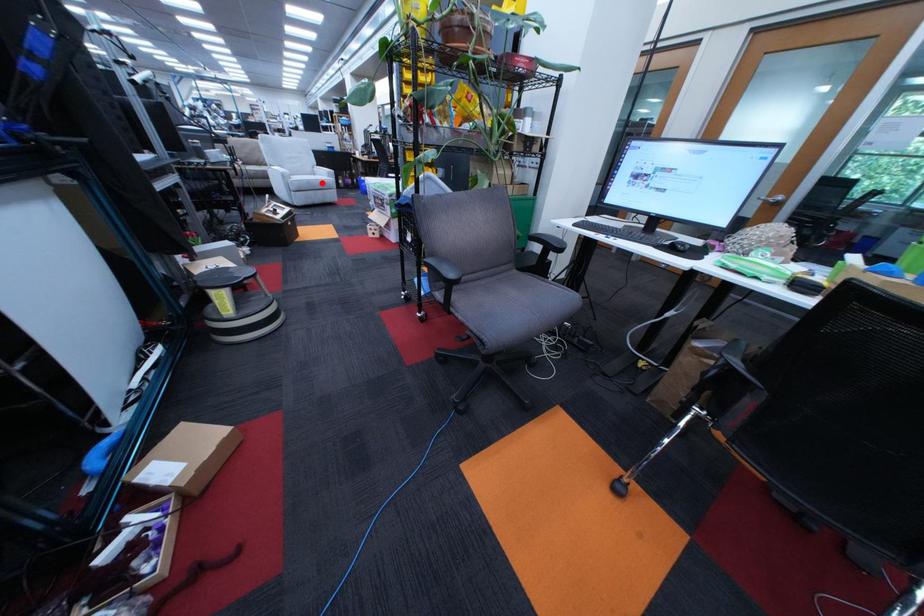
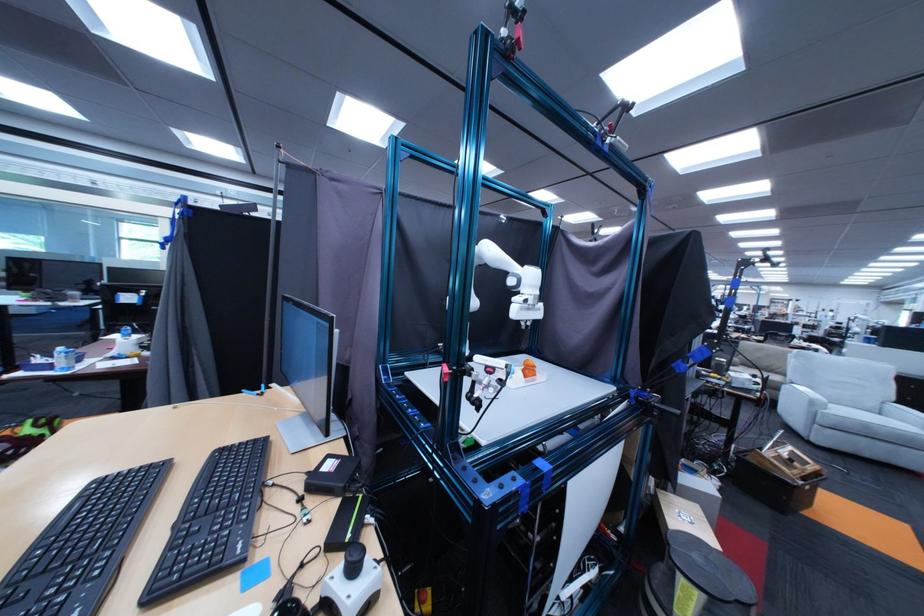
Question: I am providing you with two images of the same scene from different viewpoints. A red point is shown in image1. For the corresponding object point in image2, is it positioned nearer or farther from the camera?

Choices:
 (A) Nearer
 (B) Farther

Answer: (B)